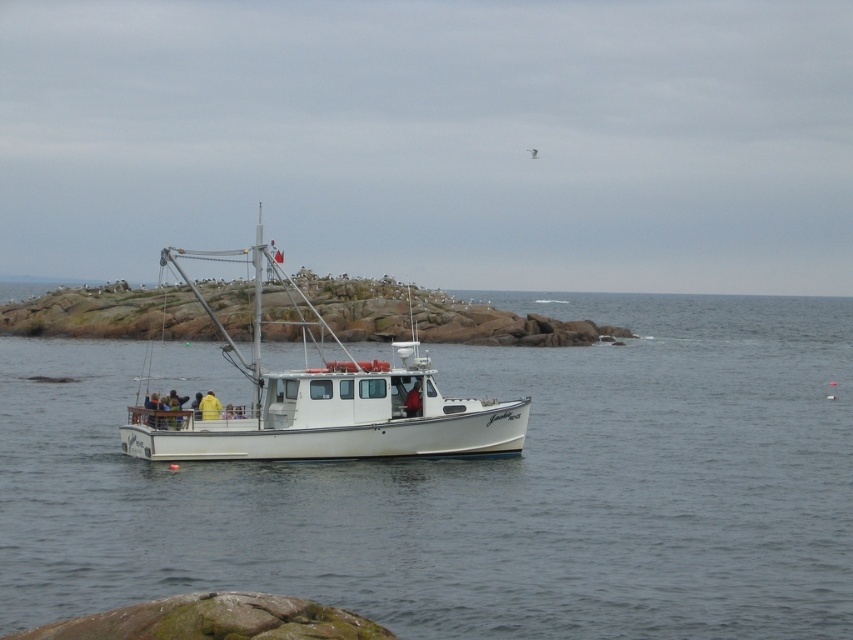
Does clear water at center have a lesser width compared to white matte boat at center?

No.

Can you confirm if clear water at center is taller than white matte boat at center?

No.

Which is behind, point (367, 570) or point (165, 419)?

Point (165, 419)

Find the location of a particular element. The image size is (853, 640). clear water at center is located at coordinates (479, 486).